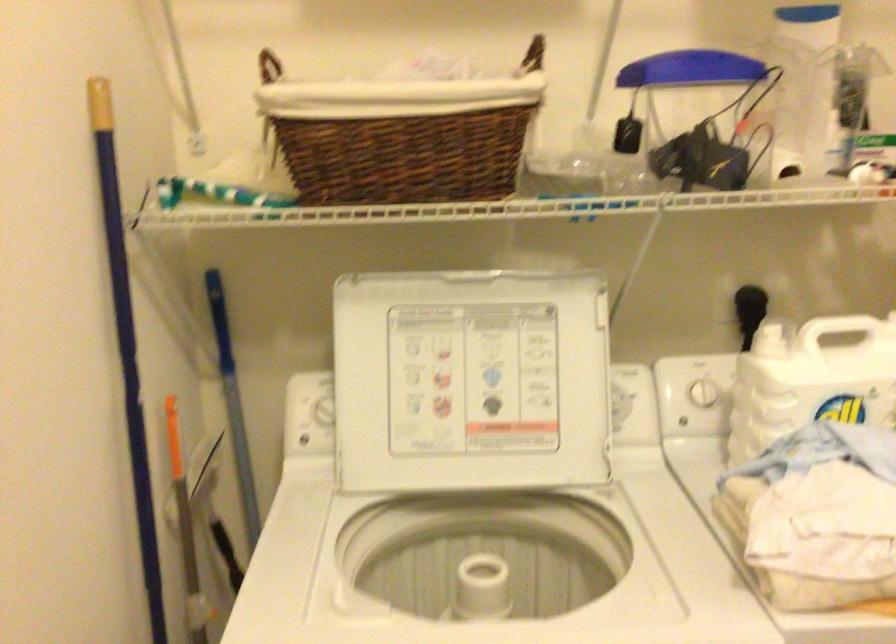
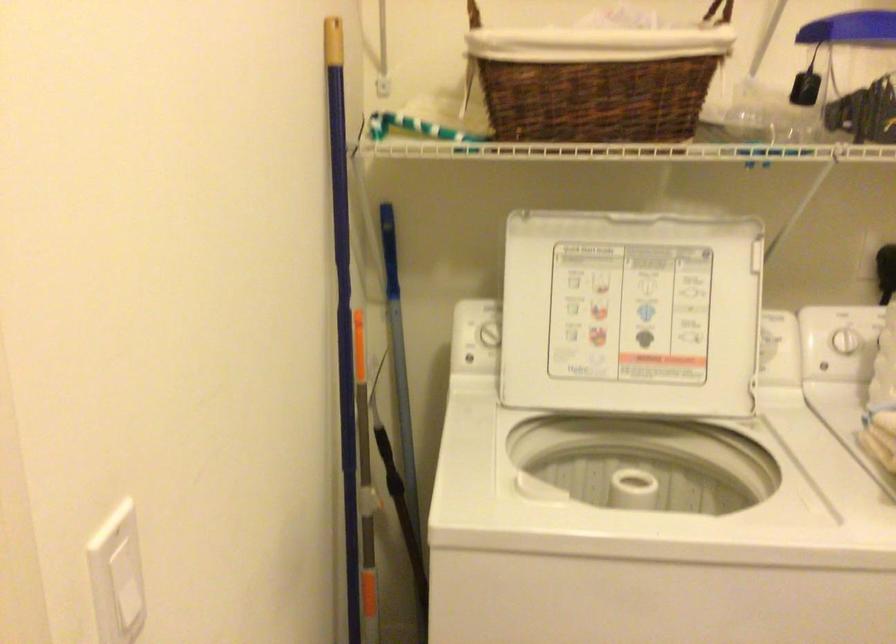
In a continuous first-person perspective shot, in which direction is the camera moving?

The cameraman walked toward left, backward.